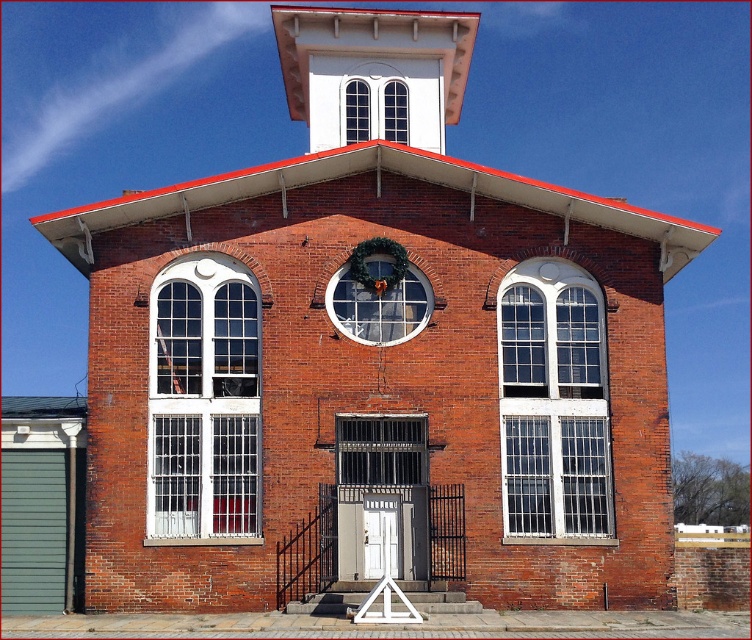
You are an architect analyzing the building facade. You observe the white textured glass window at right and the clear glass window at upper center. Which window is positioned further to the east if the building faces north?

The white textured glass window at right is positioned further to the east because it is to the right of the clear glass window at upper center, and since the building faces north, the right side corresponds to the east direction.

You are an architect analyzing the building facade. The green wreath at center and the clear glass window at upper center are both important elements. Based on their sizes, which one do you think might be more noticeable to someone standing directly in front of the building?

The green wreath at center is much taller as clear glass window at upper center, so it would be more noticeable to someone standing directly in front of the building due to its larger size.